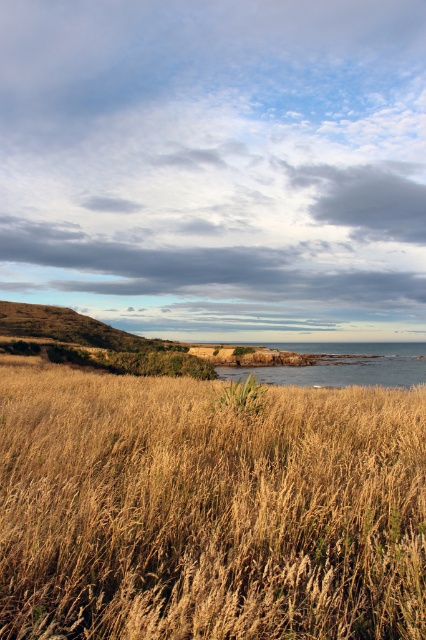
Is blue water at center taller than green grassy weed at center?

Correct, blue water at center is much taller as green grassy weed at center.

Between point (275, 376) and point (261, 387), which one is positioned in front?

Point (261, 387)

Find the location of a particular element. The image size is (426, 640). blue water at center is located at coordinates (344, 364).

Who is more distant from viewer, [180,598] or [224,404]?

Point [224,404]

Between point (288, 580) and point (210, 408), which one is positioned in front?

Point (288, 580)

The image size is (426, 640). What are the coordinates of `dry grass at center` in the screenshot? It's located at (207, 509).

Is dry grass at center smaller than blue water at center?

Correct, dry grass at center occupies less space than blue water at center.

In the scene shown: Is dry grass at center to the left of blue water at center from the viewer's perspective?

Correct, you'll find dry grass at center to the left of blue water at center.

Is point (175, 490) more distant than point (262, 380)?

No, (175, 490) is in front of (262, 380).

Locate an element on the screen. dry grass at center is located at coordinates (207, 509).